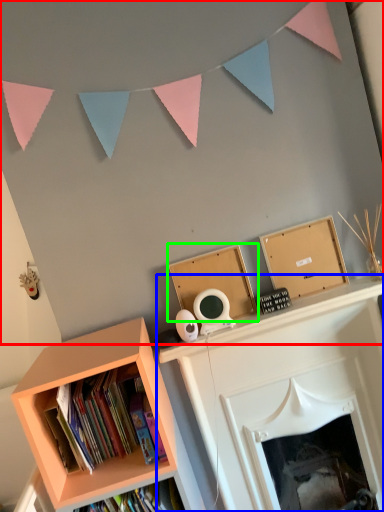
Question: Considering the real-world distances, which object is closest to backdrop (highlighted by a red box)? fireplace (highlighted by a blue box) or cardboard box (highlighted by a green box).

Choices:
 (A) fireplace
 (B) cardboard box

Answer: (B)